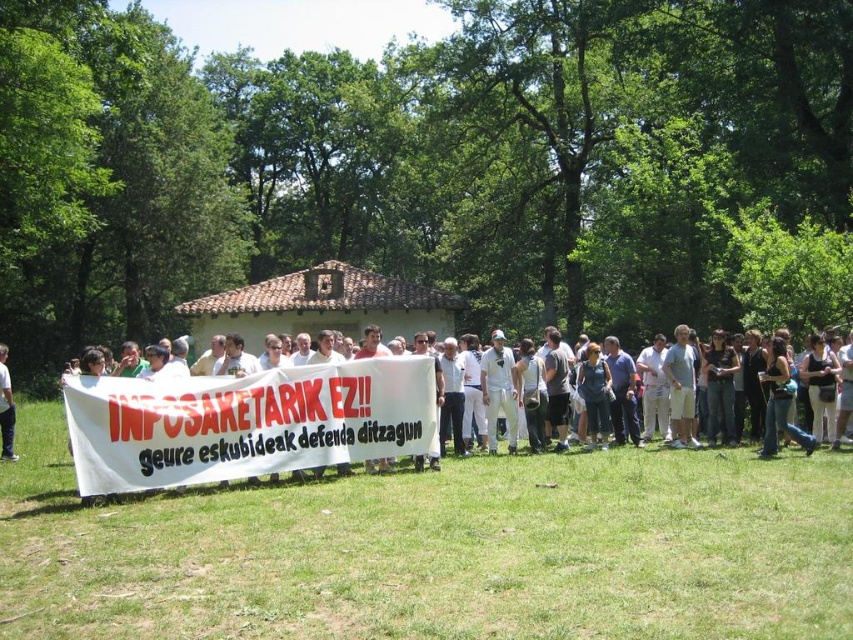
Can you confirm if white cloth banner at center is bigger than white cotton shirt at lower left?

Yes, white cloth banner at center is bigger than white cotton shirt at lower left.

Is point (339, 392) positioned after point (7, 426)?

That is False.

The image size is (853, 640). I want to click on white cloth banner at center, so click(x=244, y=422).